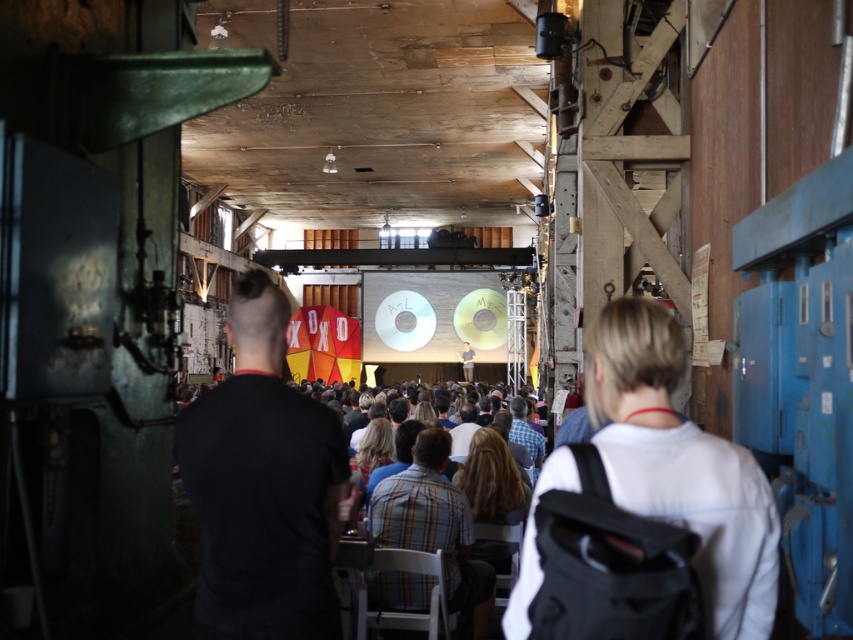
Does black shirt at center appear on the right side of white fabric shirt at center?

In fact, black shirt at center is to the left of white fabric shirt at center.

Is point (296, 541) behind point (717, 522)?

Yes, point (296, 541) is behind point (717, 522).

This screenshot has height=640, width=853. I want to click on black shirt at center, so coord(263,484).